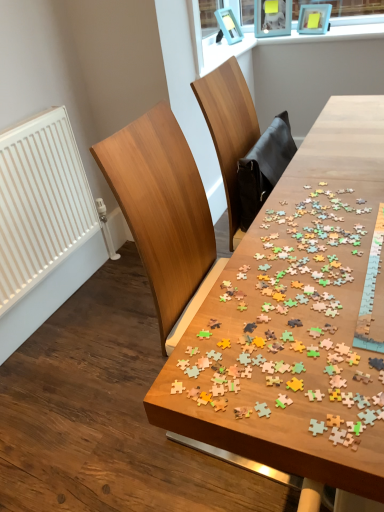
Question: In the image, is wooden puzzle pieces at center positioned in front of or behind white matte radiator at left?

Choices:
 (A) front
 (B) behind

Answer: (A)

Question: Considering the positions of point (317, 476) and point (31, 231), is point (317, 476) closer or farther from the camera than point (31, 231)?

Choices:
 (A) farther
 (B) closer

Answer: (B)

Question: Based on their sizes in the image, would you say wooden puzzle pieces at center is bigger or smaller than white matte radiator at left?

Choices:
 (A) small
 (B) big

Answer: (B)

Question: From a real-world perspective, is white matte radiator at left above or below wooden puzzle pieces at center?

Choices:
 (A) below
 (B) above

Answer: (B)

Question: In terms of width, does white matte radiator at left look wider or thinner when compared to wooden puzzle pieces at center?

Choices:
 (A) thin
 (B) wide

Answer: (A)

Question: From the image's perspective, is white matte radiator at left above or below wooden puzzle pieces at center?

Choices:
 (A) below
 (B) above

Answer: (B)

Question: Does point 18,138 appear closer or farther from the camera than point 344,254?

Choices:
 (A) farther
 (B) closer

Answer: (A)